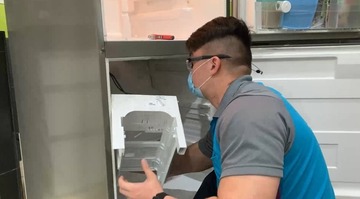
At what (x,y) coordinates should I click in order to perform the action: click on fridge. Please return your answer as a coordinate pair (x, y). This screenshot has width=360, height=199. Looking at the image, I should click on (88, 126).